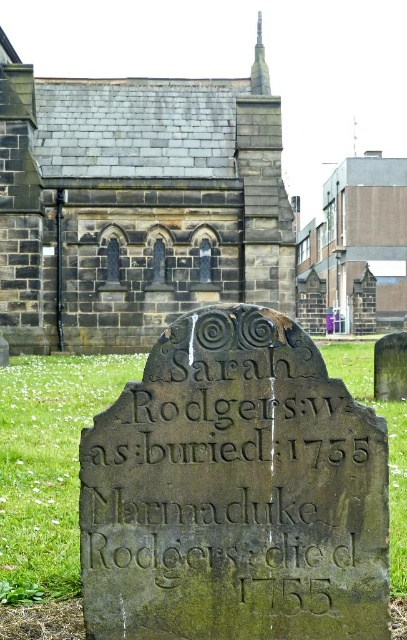
Does dark gray stone church at upper center have a smaller size compared to brown stone church at upper center?

Yes, dark gray stone church at upper center is smaller than brown stone church at upper center.

Locate an element on the screen. dark gray stone church at upper center is located at coordinates click(x=135, y=205).

Which is behind, point (256, 266) or point (398, 173)?

The point (398, 173) is more distant.

The height and width of the screenshot is (640, 407). Find the location of `dark gray stone church at upper center`. dark gray stone church at upper center is located at coordinates 135,205.

Between dark gray stone church at upper center and green grass at center, which one appears on the right side from the viewer's perspective?

green grass at center

Does dark gray stone church at upper center appear on the left side of green grass at center?

Indeed, dark gray stone church at upper center is positioned on the left side of green grass at center.

Who is more forward, [96,108] or [28,442]?

Positioned in front is point [28,442].

Image resolution: width=407 pixels, height=640 pixels. Identify the location of dark gray stone church at upper center. (135, 205).

In the scene shown: Does green grass at center have a larger size compared to brown stone church at upper center?

No.

Between green grass at center and brown stone church at upper center, which one is positioned higher?

Positioned higher is brown stone church at upper center.

Locate an element on the screen. The width and height of the screenshot is (407, 640). green grass at center is located at coordinates (48, 465).